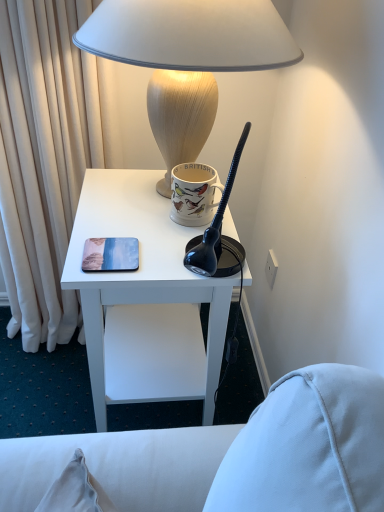
Question: From the image's perspective, does matte ceramic mug at upper center appear lower than matte plastic coaster at center left?

Choices:
 (A) no
 (B) yes

Answer: (A)

Question: Is matte plastic coaster at center left inside matte ceramic mug at upper center?

Choices:
 (A) no
 (B) yes

Answer: (A)

Question: Does matte ceramic mug at upper center have a smaller size compared to matte plastic coaster at center left?

Choices:
 (A) yes
 (B) no

Answer: (B)

Question: From a real-world perspective, is matte ceramic mug at upper center located higher than matte plastic coaster at center left?

Choices:
 (A) yes
 (B) no

Answer: (A)

Question: Is matte ceramic mug at upper center oriented away from matte plastic coaster at center left?

Choices:
 (A) no
 (B) yes

Answer: (A)

Question: Does matte ceramic mug at upper center have a lesser height compared to matte plastic coaster at center left?

Choices:
 (A) no
 (B) yes

Answer: (A)

Question: Does white matte desk at center have a greater width compared to matte beige lamp at upper center?

Choices:
 (A) no
 (B) yes

Answer: (A)

Question: Is white matte desk at center thinner than matte beige lamp at upper center?

Choices:
 (A) yes
 (B) no

Answer: (A)

Question: From the image's perspective, is white matte desk at center on top of matte beige lamp at upper center?

Choices:
 (A) yes
 (B) no

Answer: (B)

Question: Considering the relative sizes of white matte desk at center and matte beige lamp at upper center in the image provided, is white matte desk at center smaller than matte beige lamp at upper center?

Choices:
 (A) no
 (B) yes

Answer: (A)

Question: Are white matte desk at center and matte beige lamp at upper center making contact?

Choices:
 (A) yes
 (B) no

Answer: (B)

Question: Is white matte desk at center further to the viewer compared to matte beige lamp at upper center?

Choices:
 (A) yes
 (B) no

Answer: (A)

Question: Considering the relative positions of matte plastic coaster at center left and white matte desk at center in the image provided, is matte plastic coaster at center left behind white matte desk at center?

Choices:
 (A) yes
 (B) no

Answer: (A)